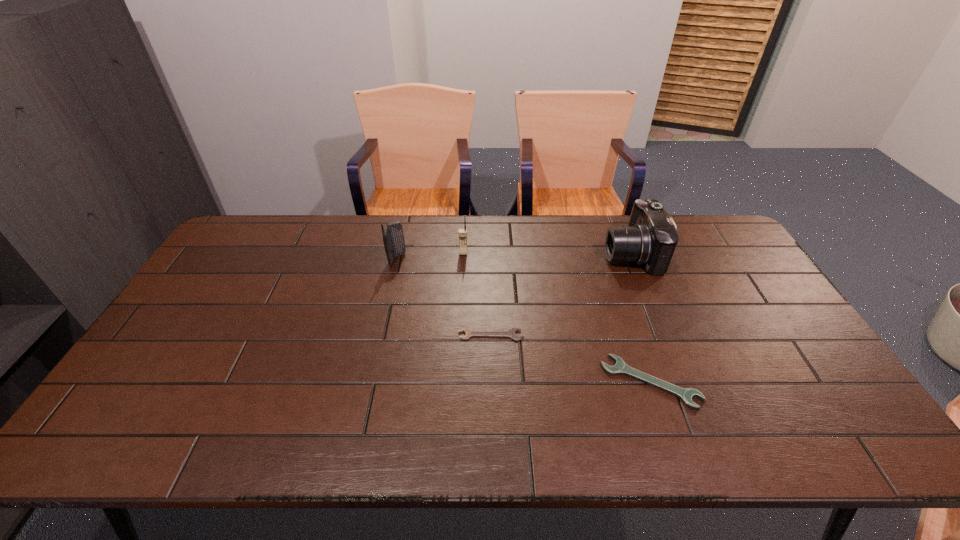
Image resolution: width=960 pixels, height=540 pixels. I want to click on free space between the leftmost object and the second nearest object, so click(x=444, y=297).

At what (x,y) coordinates should I click in order to perform the action: click on free point between the taller wrench and the left wrench. Please return your answer as a coordinate pair (x, y). The image size is (960, 540). Looking at the image, I should click on (570, 359).

Where is `empty location between the leftmost object and the right cellular telephone`? This screenshot has height=540, width=960. empty location between the leftmost object and the right cellular telephone is located at coordinates (430, 256).

Identify the location of free spot between the nearer wrench and the right cellular telephone. The image size is (960, 540). (557, 317).

Find the location of a particular element. unoccupied position between the shortest object and the right cellular telephone is located at coordinates (477, 294).

The height and width of the screenshot is (540, 960). In order to click on free space between the taller wrench and the right cellular telephone in this screenshot , I will do `click(557, 317)`.

I want to click on vacant space that's between the leftmost object and the shortest object, so click(x=444, y=297).

The image size is (960, 540). Find the location of `free spot between the shortest object and the leftmost object`. free spot between the shortest object and the leftmost object is located at coordinates (444, 297).

You are a GUI agent. You are given a task and a screenshot of the screen. Output one action in this format:
    pyautogui.click(x=<x>, y=<y>)
    Task: Click on the empty space between the right cellular telephone and the camera
    
    Given the screenshot: What is the action you would take?
    pyautogui.click(x=547, y=253)

Select which object appears as the fourth closest to the right cellular telephone. Please provide its 2D coordinates. Your answer should be formatted as a tuple, i.e. [(x, y)], where the tuple contains the x and y coordinates of a point satisfying the conditions above.

[(685, 394)]